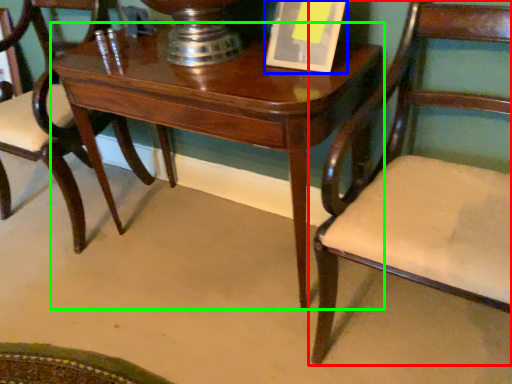
Question: Which is farther away from chair (highlighted by a red box)? paperback book (highlighted by a blue box) or table (highlighted by a green box)?

Choices:
 (A) paperback book
 (B) table

Answer: (A)